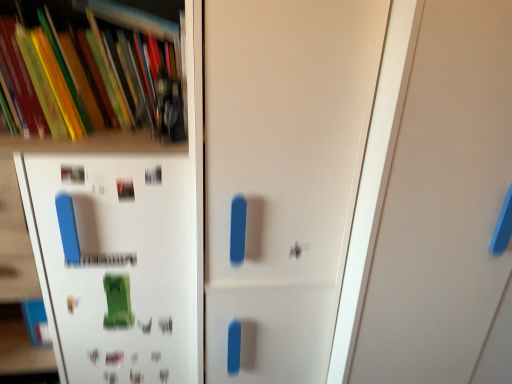
Question: Is point (115, 74) positioned closer to the camera than point (472, 84)?

Choices:
 (A) farther
 (B) closer

Answer: (A)

Question: Which is correct: matte plastic books at upper left is inside white matte door at center, which ranks as the first door in right-to-left order, or outside of it?

Choices:
 (A) inside
 (B) outside

Answer: (B)

Question: Estimate the real-world distances between objects in this image. Which object is farther from the matte white door at center, the 2th door from the right?

Choices:
 (A) white matte shelf at upper left
 (B) white matte door at center, which ranks as the first door in right-to-left order
 (C) matte plastic books at upper left

Answer: (C)

Question: Estimate the real-world distances between objects in this image. Which object is farther from the matte plastic books at upper left?

Choices:
 (A) matte white door at center, the 2th door from the right
 (B) white matte shelf at upper left
 (C) white matte door at center, which ranks as the first door in right-to-left order

Answer: (C)